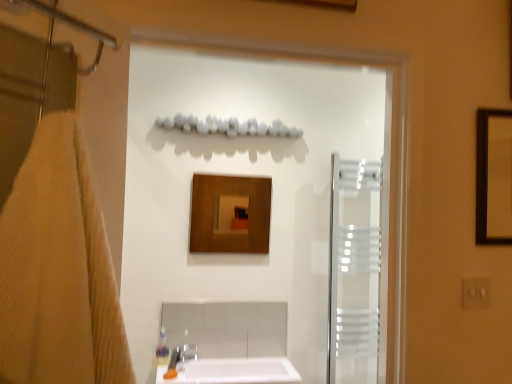
Find the location of a particular element. The width and height of the screenshot is (512, 384). wooden mirror at center is located at coordinates (219, 213).

Describe the element at coordinates (219, 213) in the screenshot. The height and width of the screenshot is (384, 512). I see `wooden mirror at center` at that location.

Locate an element on the screen. beige textured towel at left is located at coordinates (58, 269).

The height and width of the screenshot is (384, 512). I want to click on transparent glass screen door at center, acting as the first screen door starting from the left, so click(244, 174).

Does translucent frosted glass screen door at right, positioned as the first screen door in back-to-front order, have a larger size compared to transparent glass screen door at center, acting as the first screen door starting from the left?

No.

From a real-world perspective, is translucent frosted glass screen door at right, positioned as the first screen door in back-to-front order, positioned above or below transparent glass screen door at center, the 1th screen door when ordered from front to back?

From a real-world perspective, translucent frosted glass screen door at right, positioned as the first screen door in back-to-front order, is physically below transparent glass screen door at center, the 1th screen door when ordered from front to back.

Are translucent frosted glass screen door at right, which is the 1th screen door in right-to-left order, and transparent glass screen door at center, the 1th screen door when ordered from front to back, located far from each other?

That's not correct — translucent frosted glass screen door at right, which is the 1th screen door in right-to-left order, is a little close to transparent glass screen door at center, the 1th screen door when ordered from front to back.

Consider the image. Between translucent frosted glass screen door at right, placed as the second screen door when sorted from left to right, and transparent glass screen door at center, the 1th screen door when ordered from front to back, which one has smaller width?

Thinner between the two is translucent frosted glass screen door at right, placed as the second screen door when sorted from left to right.

Considering the positions of objects translucent frosted glass screen door at right, which is the 1th screen door in right-to-left order, and beige textured towel at left in the image provided, who is more to the left, translucent frosted glass screen door at right, which is the 1th screen door in right-to-left order, or beige textured towel at left?

From the viewer's perspective, beige textured towel at left appears more on the left side.

Is the position of translucent frosted glass screen door at right, acting as the second screen door starting from the front, more distant than that of beige textured towel at left?

Yes, translucent frosted glass screen door at right, acting as the second screen door starting from the front, is behind beige textured towel at left.

Is translucent frosted glass screen door at right, placed as the second screen door when sorted from left to right, looking in the opposite direction of beige textured towel at left?

No, translucent frosted glass screen door at right, placed as the second screen door when sorted from left to right,'s orientation is not away from beige textured towel at left.

From the picture: Is translucent frosted glass screen door at right, positioned as the first screen door in back-to-front order, far from beige textured towel at left?

translucent frosted glass screen door at right, positioned as the first screen door in back-to-front order, is far away from beige textured towel at left.

Between white glossy sink at lower center and transparent glass screen door at center, placed as the 2th screen door when sorted from back to front, which one is positioned behind?

white glossy sink at lower center is further away from the camera.

Considering the relative sizes of white glossy sink at lower center and transparent glass screen door at center, which is the second screen door from right to left, in the image provided, is white glossy sink at lower center wider than transparent glass screen door at center, which is the second screen door from right to left,?

Yes, white glossy sink at lower center is wider than transparent glass screen door at center, which is the second screen door from right to left.

Considering the relative sizes of white glossy sink at lower center and transparent glass screen door at center, placed as the 2th screen door when sorted from back to front, in the image provided, is white glossy sink at lower center shorter than transparent glass screen door at center, placed as the 2th screen door when sorted from back to front,?

Yes, white glossy sink at lower center is shorter than transparent glass screen door at center, placed as the 2th screen door when sorted from back to front.

Choose the correct answer: Is white glossy sink at lower center inside transparent glass screen door at center, which is the second screen door from right to left, or outside it?

white glossy sink at lower center exists outside the volume of transparent glass screen door at center, which is the second screen door from right to left.

Choose the correct answer: Is beige textured towel at left inside wooden mirror at center or outside it?

beige textured towel at left cannot be found inside wooden mirror at center.

Is beige textured towel at left bigger or smaller than wooden mirror at center?

beige textured towel at left is bigger than wooden mirror at center.

Considering the relative sizes of beige textured towel at left and wooden mirror at center in the image provided, is beige textured towel at left shorter than wooden mirror at center?

Incorrect, the height of beige textured towel at left does not fall short of that of wooden mirror at center.

In the scene shown: From the image's perspective, which is above, beige textured towel at left or wooden mirror at center?

wooden mirror at center is shown above in the image.

Is translucent frosted glass screen door at right, placed as the second screen door when sorted from left to right, looking in the opposite direction of wooden mirror at center?

No, wooden mirror at center is not at the back of translucent frosted glass screen door at right, placed as the second screen door when sorted from left to right.

From a real-world perspective, is translucent frosted glass screen door at right, which is the 1th screen door in right-to-left order, over wooden mirror at center?

Incorrect, from a real-world perspective, translucent frosted glass screen door at right, which is the 1th screen door in right-to-left order, is lower than wooden mirror at center.

What's the angular difference between translucent frosted glass screen door at right, positioned as the first screen door in back-to-front order, and wooden mirror at center's facing directions?

The angular difference between translucent frosted glass screen door at right, positioned as the first screen door in back-to-front order, and wooden mirror at center is 0.803 degrees.

Which of these two, translucent frosted glass screen door at right, acting as the second screen door starting from the front, or white glossy sink at lower center, is bigger?

translucent frosted glass screen door at right, acting as the second screen door starting from the front.

Consider the image. From a real-world perspective, between translucent frosted glass screen door at right, acting as the second screen door starting from the front, and white glossy sink at lower center, who is vertically higher?

translucent frosted glass screen door at right, acting as the second screen door starting from the front, is physically above.

In terms of height, does translucent frosted glass screen door at right, acting as the second screen door starting from the front, look taller or shorter compared to white glossy sink at lower center?

translucent frosted glass screen door at right, acting as the second screen door starting from the front, is taller than white glossy sink at lower center.

Is translucent frosted glass screen door at right, placed as the second screen door when sorted from left to right, in contact with white glossy sink at lower center?

No, translucent frosted glass screen door at right, placed as the second screen door when sorted from left to right, is not beside white glossy sink at lower center.

Consider the image. Considering the relative sizes of beige textured towel at left and transparent glass screen door at center, placed as the 2th screen door when sorted from back to front, in the image provided, is beige textured towel at left bigger than transparent glass screen door at center, placed as the 2th screen door when sorted from back to front,?

No, beige textured towel at left is not bigger than transparent glass screen door at center, placed as the 2th screen door when sorted from back to front.

From their relative heights in the image, would you say beige textured towel at left is taller or shorter than transparent glass screen door at center, placed as the 2th screen door when sorted from back to front?

Clearly, beige textured towel at left is shorter compared to transparent glass screen door at center, placed as the 2th screen door when sorted from back to front.

From a real-world perspective, is beige textured towel at left above or below transparent glass screen door at center, which is the second screen door from right to left?

beige textured towel at left is situated lower than transparent glass screen door at center, which is the second screen door from right to left, in the real world.

Where is `screen door located on the left of translucent frosted glass screen door at right, acting as the second screen door starting from the front`? screen door located on the left of translucent frosted glass screen door at right, acting as the second screen door starting from the front is located at coordinates (244, 174).

You are a GUI agent. You are given a task and a screenshot of the screen. Output one action in this format:
    pyautogui.click(x=<x>, y=<y>)
    Task: Click on the 2nd screen door to the right when counting from the beige textured towel at left
    The height and width of the screenshot is (384, 512).
    Given the screenshot: What is the action you would take?
    pyautogui.click(x=354, y=271)

Which object lies further to the anchor point wooden mirror at center, beige textured towel at left or transparent glass screen door at center, which is the second screen door from right to left?

beige textured towel at left is further to wooden mirror at center.

Based on the photo, when comparing their distances from white glossy sink at lower center, does wooden mirror at center or beige textured towel at left seem closer?

Among the two, wooden mirror at center is located nearer to white glossy sink at lower center.

From the image, which object appears to be nearer to translucent frosted glass screen door at right, placed as the second screen door when sorted from left to right, white glossy sink at lower center or beige textured towel at left?

white glossy sink at lower center.

Looking at the image, which one is located further to wooden mirror at center, beige textured towel at left or translucent frosted glass screen door at right, placed as the second screen door when sorted from left to right?

Based on the image, beige textured towel at left appears to be further to wooden mirror at center.

Estimate the real-world distances between objects in this image. Which object is closer to wooden mirror at center, translucent frosted glass screen door at right, placed as the second screen door when sorted from left to right, or transparent glass screen door at center, the 1th screen door when ordered from front to back?

transparent glass screen door at center, the 1th screen door when ordered from front to back.

When comparing their distances from translucent frosted glass screen door at right, positioned as the first screen door in back-to-front order, does transparent glass screen door at center, placed as the 2th screen door when sorted from back to front, or wooden mirror at center seem closer?

transparent glass screen door at center, placed as the 2th screen door when sorted from back to front, is closer to translucent frosted glass screen door at right, positioned as the first screen door in back-to-front order.

Consider the image. From the image, which object appears to be nearer to beige textured towel at left, transparent glass screen door at center, the 1th screen door when ordered from front to back, or wooden mirror at center?

wooden mirror at center lies closer to beige textured towel at left than the other object.

Considering their positions, is translucent frosted glass screen door at right, which is the 1th screen door in right-to-left order, positioned closer to transparent glass screen door at center, the 1th screen door when ordered from front to back, than beige textured towel at left?

Among the two, translucent frosted glass screen door at right, which is the 1th screen door in right-to-left order, is located nearer to transparent glass screen door at center, the 1th screen door when ordered from front to back.

This screenshot has height=384, width=512. What are the coordinates of `screen door between beige textured towel at left and translucent frosted glass screen door at right, which is the 1th screen door in right-to-left order, along the z-axis` in the screenshot? It's located at (244, 174).

You are a GUI agent. You are given a task and a screenshot of the screen. Output one action in this format:
    pyautogui.click(x=<x>, y=<y>)
    Task: Click on the sink located between transparent glass screen door at center, placed as the 2th screen door when sorted from back to front, and wooden mirror at center in the depth direction
    Image resolution: width=512 pixels, height=384 pixels.
    Given the screenshot: What is the action you would take?
    pyautogui.click(x=233, y=371)

Identify the location of sink between beige textured towel at left and translucent frosted glass screen door at right, which is the 1th screen door in right-to-left order, from front to back. (233, 371).

I want to click on screen door between beige textured towel at left and wooden mirror at center from front to back, so click(244, 174).